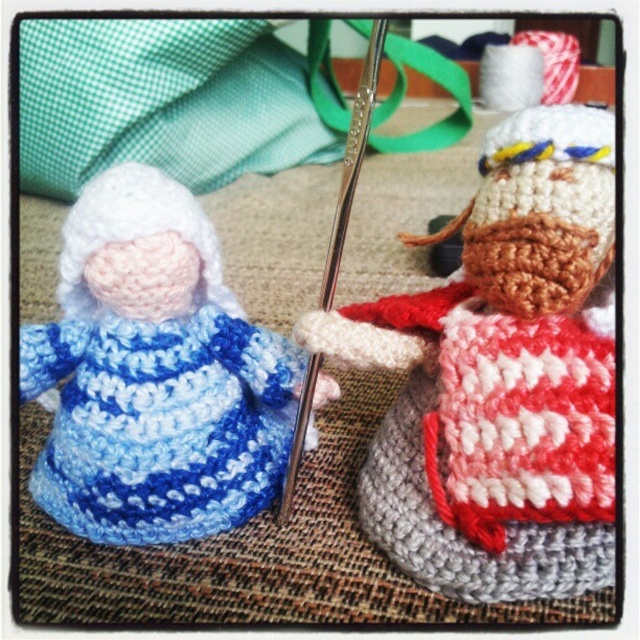
Can you confirm if red and white knitted sweater at center is positioned to the left of blue yarn doll at left?

Incorrect, red and white knitted sweater at center is not on the left side of blue yarn doll at left.

Is red and white knitted sweater at center taller than blue yarn doll at left?

Yes, red and white knitted sweater at center is taller than blue yarn doll at left.

Where is `red and white knitted sweater at center`? The image size is (640, 640). red and white knitted sweater at center is located at coordinates (499, 372).